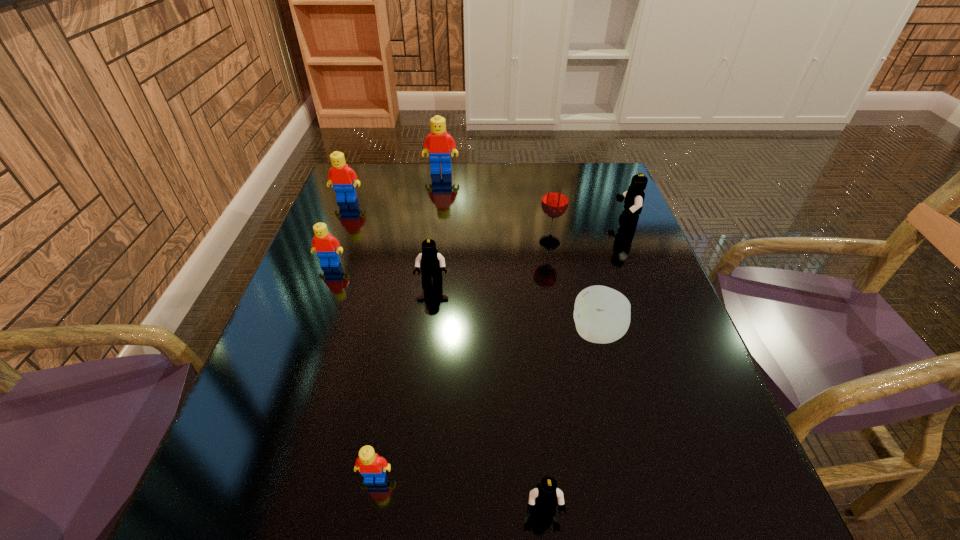
Where is `the second smallest black Lego`? The width and height of the screenshot is (960, 540). the second smallest black Lego is located at coordinates (431, 263).

At what (x,y) coordinates should I click in order to perform the action: click on the leftmost black Lego. Please return your answer as a coordinate pair (x, y). Looking at the image, I should click on (431, 263).

Where is `white apple`? white apple is located at coordinates (602, 315).

Locate an element on the screen. This screenshot has width=960, height=540. apple is located at coordinates (602, 315).

The image size is (960, 540). What are the coordinates of `the smallest red Lego` in the screenshot? It's located at (370, 465).

I want to click on the sixth farthest Lego, so pos(370,465).

This screenshot has height=540, width=960. I want to click on the nearest black Lego, so [546, 495].

Where is `the fourth object from right to left`? the fourth object from right to left is located at coordinates (546, 495).

Locate an element on the screen. The width and height of the screenshot is (960, 540). free space located 0.140m on the face of the farthest Lego is located at coordinates (438, 200).

At what (x,y) coordinates should I click in order to perform the action: click on vacant space situated on the back of the fourth farthest object. Please return your answer as a coordinate pair (x, y). Looking at the image, I should click on (545, 221).